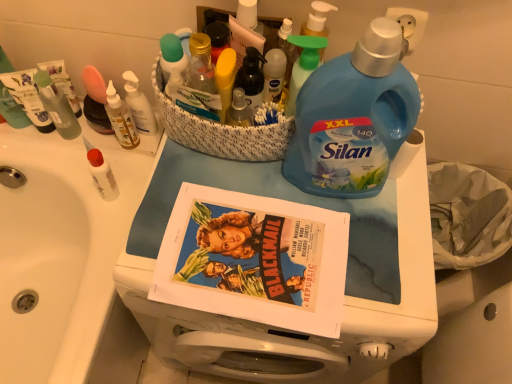
Question: Is blue plastic laundry detergent at center not close to translucent plastic bottle at upper center, the 4th toiletry viewed from the left?

Choices:
 (A) no
 (B) yes

Answer: (A)

Question: Is translucent plastic bottle at upper center, the 4th toiletry viewed from the left, completely or partially inside blue plastic laundry detergent at center?

Choices:
 (A) no
 (B) yes

Answer: (A)

Question: Can you confirm if blue plastic laundry detergent at center is positioned to the right of translucent plastic bottle at upper center, the 4th toiletry viewed from the left?

Choices:
 (A) no
 (B) yes

Answer: (B)

Question: From a real-world perspective, is blue plastic laundry detergent at center located higher than translucent plastic bottle at upper center, placed as the first toiletry when sorted from right to left?

Choices:
 (A) no
 (B) yes

Answer: (A)

Question: Is blue plastic laundry detergent at center in contact with translucent plastic bottle at upper center, placed as the first toiletry when sorted from right to left?

Choices:
 (A) no
 (B) yes

Answer: (A)

Question: Is blue plastic laundry detergent at center bigger than translucent plastic bottle at upper center, the 4th toiletry viewed from the left?

Choices:
 (A) no
 (B) yes

Answer: (B)

Question: Is the surface of green plastic spray bottle at upper center in direct contact with translucent plastic bottle at center, which is counted as the 2th bottle, starting from the right?

Choices:
 (A) no
 (B) yes

Answer: (B)

Question: Would you say green plastic spray bottle at upper center is outside translucent plastic bottle at center, which is counted as the 2th bottle, starting from the right?

Choices:
 (A) yes
 (B) no

Answer: (A)

Question: Is green plastic spray bottle at upper center at the left side of translucent plastic bottle at center, which appears as the first bottle when viewed from the left?

Choices:
 (A) yes
 (B) no

Answer: (B)

Question: From the image's perspective, does green plastic spray bottle at upper center appear lower than translucent plastic bottle at center, which appears as the first bottle when viewed from the left?

Choices:
 (A) yes
 (B) no

Answer: (A)

Question: From a real-world perspective, is green plastic spray bottle at upper center located beneath translucent plastic bottle at center, which appears as the first bottle when viewed from the left?

Choices:
 (A) yes
 (B) no

Answer: (B)

Question: Does green plastic spray bottle at upper center come in front of translucent plastic bottle at center, which appears as the first bottle when viewed from the left?

Choices:
 (A) no
 (B) yes

Answer: (B)

Question: Is translucent plastic bottle at center, which is counted as the 2th bottle, starting from the right, positioned far away from blue plastic laundry detergent at center?

Choices:
 (A) yes
 (B) no

Answer: (B)